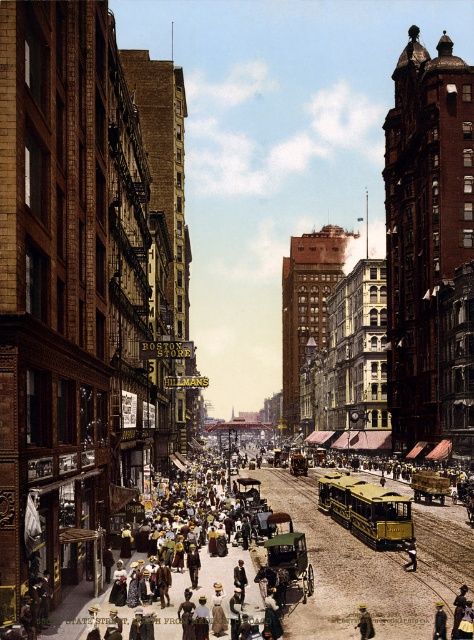
Who is lower down, light brown leather hat at center or leather jacket at center?

leather jacket at center is lower down.

What do you see at coordinates (364, 621) in the screenshot? I see `light brown leather hat at center` at bounding box center [364, 621].

Find the location of `light brown leather hat at center`. light brown leather hat at center is located at coordinates [364, 621].

Find the location of a particular element. The width and height of the screenshot is (474, 640). light brown leather hat at center is located at coordinates click(364, 621).

Does light brown leather hat at center have a smaller size compared to yellow felt hat at center?

No.

Does light brown leather hat at center appear over yellow felt hat at center?

No, light brown leather hat at center is not above yellow felt hat at center.

At what (x,y) coordinates should I click in order to perform the action: click on light brown leather hat at center. Please return your answer as a coordinate pair (x, y). Image resolution: width=474 pixels, height=640 pixels. Looking at the image, I should click on (364, 621).

Between yellow cotton dress at center and leather jacket at center, which one has more height?

yellow cotton dress at center is taller.

Does yellow cotton dress at center have a lesser width compared to leather jacket at center?

Incorrect, yellow cotton dress at center's width is not less than leather jacket at center's.

Is point (176, 561) farther from viewer compared to point (411, 547)?

Yes, it is.

Find the location of a particular element. yellow cotton dress at center is located at coordinates (188, 536).